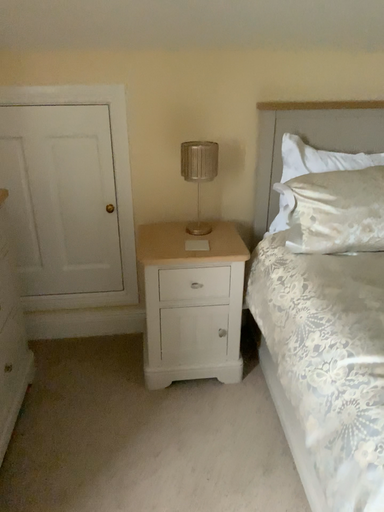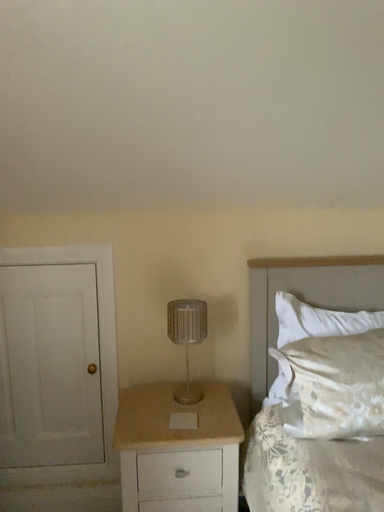
Question: Which way did the camera rotate in the video?

Choices:
 (A) rotated upward
 (B) rotated downward

Answer: (A)